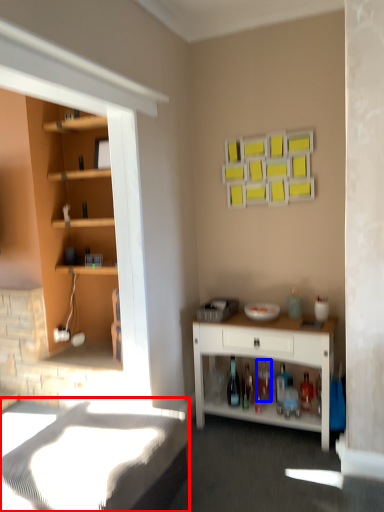
Question: Which of the following is the closest to the observer, bed frame (highlighted by a red box) or bottle (highlighted by a blue box)?

Choices:
 (A) bed frame
 (B) bottle

Answer: (A)